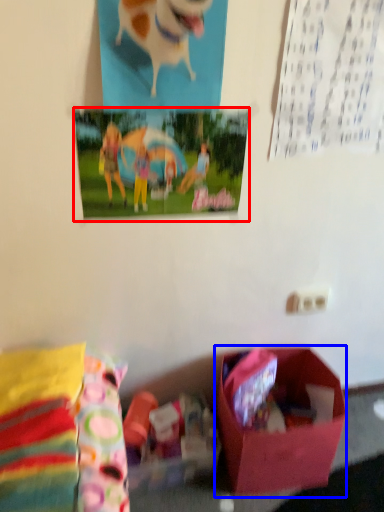
Question: Among these objects, which one is farthest to the camera, postcard (highlighted by a red box) or box (highlighted by a blue box)?

Choices:
 (A) postcard
 (B) box

Answer: (B)